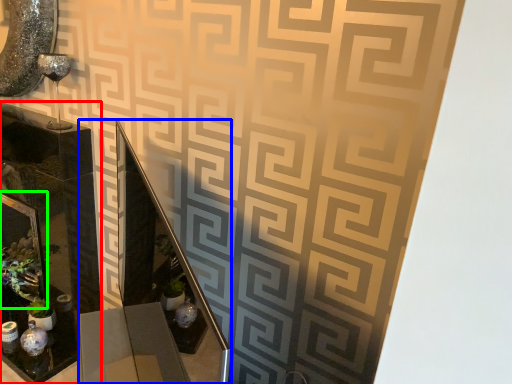
Question: Estimate the real-world distances between objects in this image. Which object is farther from glass box (highlighted by a red box), vanity (highlighted by a blue box) or picture frame (highlighted by a green box)?

Choices:
 (A) vanity
 (B) picture frame

Answer: (A)